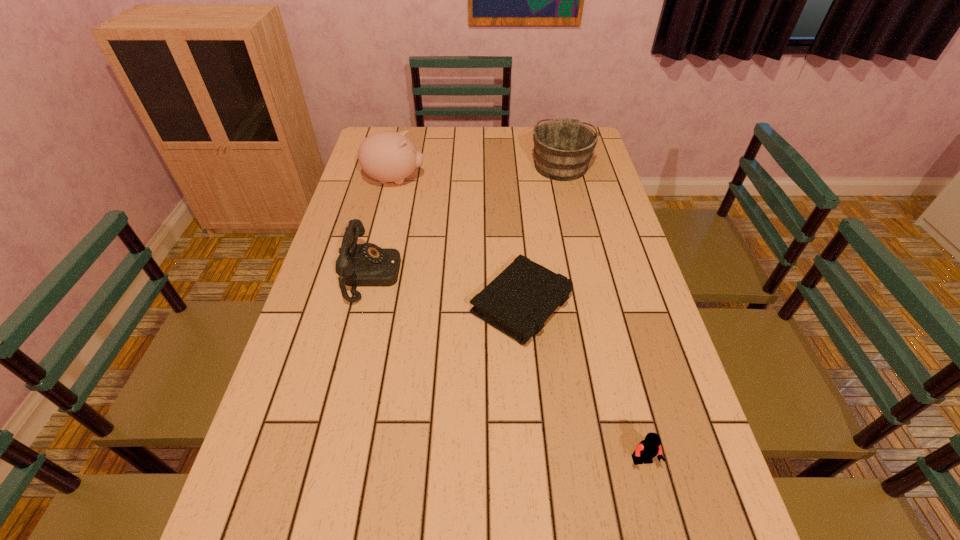
This screenshot has width=960, height=540. I want to click on piggy bank, so click(x=388, y=156).

You are a GUI agent. You are given a task and a screenshot of the screen. Output one action in this format:
    pyautogui.click(x=<x>, y=<y>)
    Task: Click on the wine bucket
    This screenshot has width=960, height=540.
    Given the screenshot: What is the action you would take?
    pyautogui.click(x=563, y=148)

In order to click on telephone in this screenshot , I will do `click(366, 264)`.

This screenshot has width=960, height=540. What are the coordinates of `Lego` in the screenshot? It's located at (648, 448).

This screenshot has height=540, width=960. In order to click on the second shortest object in this screenshot , I will do `click(648, 448)`.

You are a GUI agent. You are given a task and a screenshot of the screen. Output one action in this format:
    pyautogui.click(x=<x>, y=<y>)
    Task: Click on the shortest object
    The width and height of the screenshot is (960, 540).
    Given the screenshot: What is the action you would take?
    pyautogui.click(x=522, y=297)

Locate an element on the screen. The image size is (960, 540). free spot located at the snout of the piggy bank is located at coordinates (492, 180).

You are a GUI agent. You are given a task and a screenshot of the screen. Output one action in this format:
    pyautogui.click(x=<x>, y=<y>)
    Task: Click on the vacant region located on the left of the wine bucket
    
    Given the screenshot: What is the action you would take?
    pyautogui.click(x=481, y=165)

In order to click on vacant region located 0.080m on the dial of the telephone in this screenshot , I will do `click(428, 275)`.

Identify the location of free region located on the front of the shortest object. This screenshot has width=960, height=540. (528, 375).